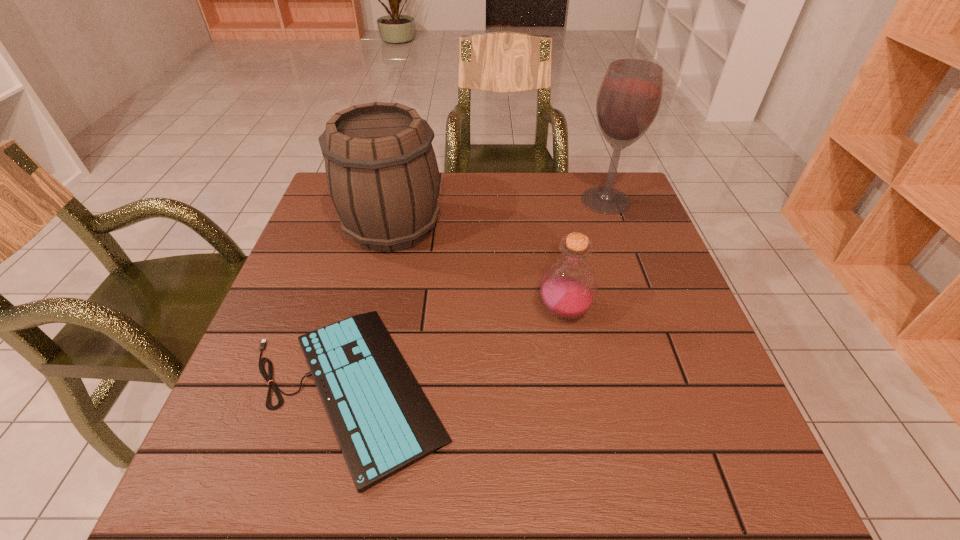
The height and width of the screenshot is (540, 960). In order to click on alcohol situated at the far edge in this screenshot , I will do tap(630, 95).

The height and width of the screenshot is (540, 960). What are the coordinates of `wine bucket present at the far edge` in the screenshot? It's located at (381, 169).

At what (x,y) coordinates should I click in order to perform the action: click on object at the near edge. Please return your answer as a coordinate pair (x, y). The height and width of the screenshot is (540, 960). Looking at the image, I should click on (383, 422).

You are a GUI agent. You are given a task and a screenshot of the screen. Output one action in this format:
    pyautogui.click(x=<x>, y=<y>)
    Task: Click on the wine bucket located in the left edge section of the desktop
    The height and width of the screenshot is (540, 960).
    Given the screenshot: What is the action you would take?
    pyautogui.click(x=381, y=169)

The image size is (960, 540). I want to click on computer keyboard present at the left edge, so click(x=383, y=422).

Locate an element on the screen. Image resolution: width=960 pixels, height=540 pixels. object positioned at the right edge is located at coordinates (630, 95).

I want to click on object that is positioned at the far left corner, so click(381, 169).

Locate an element on the screen. object that is positioned at the near left corner is located at coordinates (383, 422).

In order to click on object located at the far right corner in this screenshot , I will do `click(630, 95)`.

In the image, there is a desktop. Where is `vacant space at the far edge`? vacant space at the far edge is located at coordinates (549, 192).